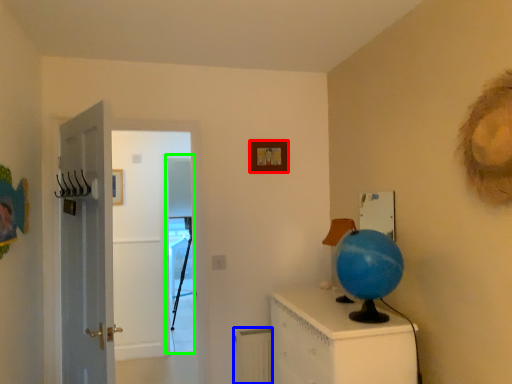
Question: Which object is the farthest from picture frame (highlighted by a red box)? Choose among these: radiator (highlighted by a blue box) or screen door (highlighted by a green box).

Choices:
 (A) radiator
 (B) screen door

Answer: (B)